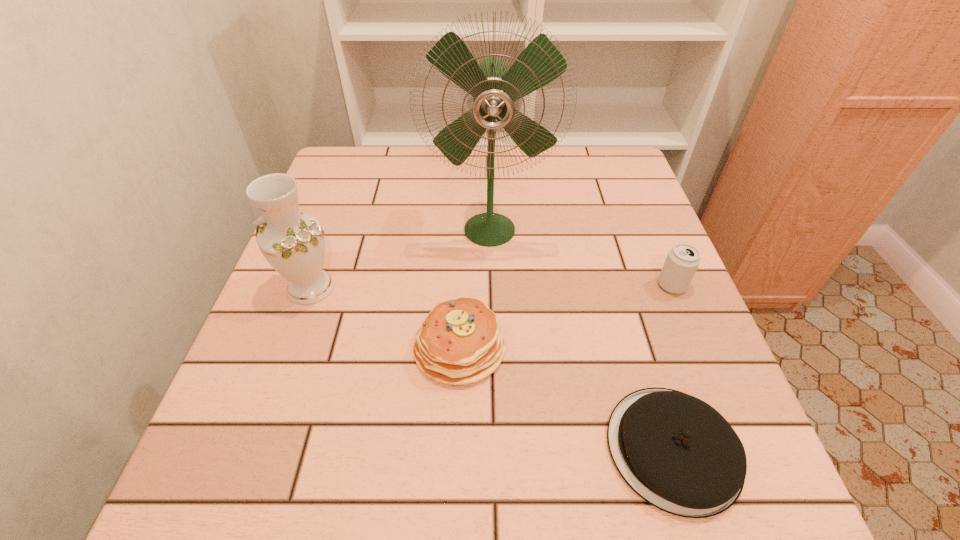
Where is `fan`? The width and height of the screenshot is (960, 540). fan is located at coordinates (494, 89).

You are a GUI agent. You are given a task and a screenshot of the screen. Output one action in this format:
    pyautogui.click(x=<x>, y=<y>)
    Task: Click on the farthest object
    
    Given the screenshot: What is the action you would take?
    pyautogui.click(x=494, y=89)

Identify the location of the second tallest object. The width and height of the screenshot is (960, 540). (293, 243).

At what (x,y) coordinates should I click in order to perform the action: click on vase. Please return your answer as a coordinate pair (x, y). The image size is (960, 540). Looking at the image, I should click on (293, 243).

Locate an element on the screen. can is located at coordinates (682, 261).

Where is `the left pancake`? The width and height of the screenshot is (960, 540). the left pancake is located at coordinates (459, 342).

Locate an element on the screen. the taller pancake is located at coordinates (459, 342).

Where is `the right pancake`? This screenshot has width=960, height=540. the right pancake is located at coordinates (678, 453).

You are a GUI agent. You are given a task and a screenshot of the screen. Output one action in this format:
    pyautogui.click(x=<x>, y=<y>)
    Task: Click on the nearer pancake
    
    Given the screenshot: What is the action you would take?
    pyautogui.click(x=678, y=453)

Where is `vacant space located 0.260m on the front-facing side of the farthest object`? This screenshot has height=540, width=960. vacant space located 0.260m on the front-facing side of the farthest object is located at coordinates (492, 352).